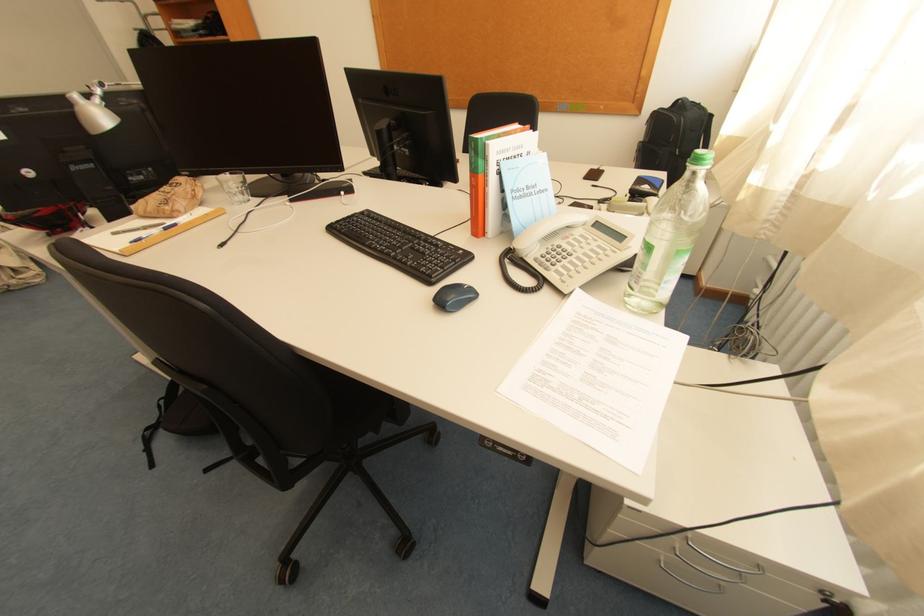
This screenshot has width=924, height=616. Describe the element at coordinates (578, 254) in the screenshot. I see `the telephone buttons` at that location.